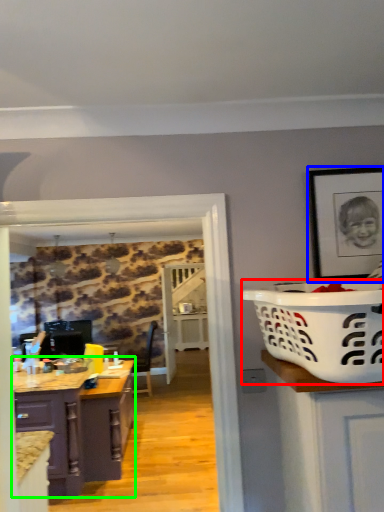
Question: Based on their relative distances, which object is nearer to basket container (highlighted by a red box)? Choose from picture frame (highlighted by a blue box) and cabinetry (highlighted by a green box).

Choices:
 (A) picture frame
 (B) cabinetry

Answer: (A)